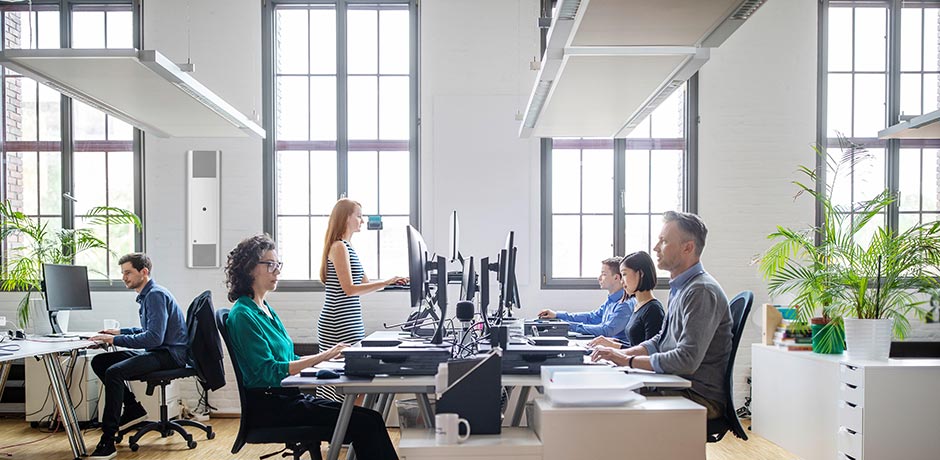
The image size is (940, 460). In order to click on computer monitors in this screenshot , I will do `click(506, 299)`, `click(517, 299)`, `click(471, 280)`, `click(411, 271)`, `click(453, 231)`, `click(64, 283)`.